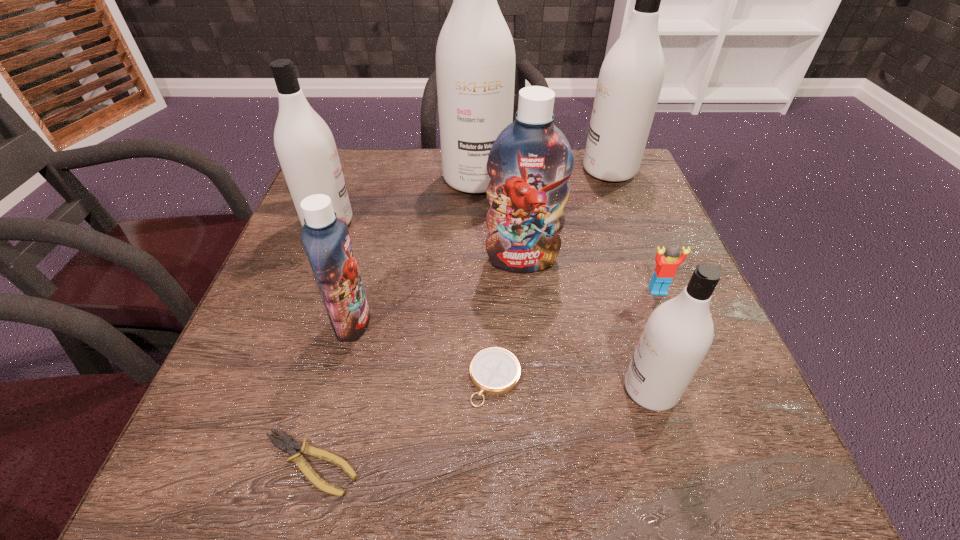
Identify the location of the tallest shampoo. The height and width of the screenshot is (540, 960). (475, 55).

In order to click on the tallest object in this screenshot , I will do `click(475, 55)`.

This screenshot has width=960, height=540. I want to click on the second tallest object, so click(x=630, y=79).

The image size is (960, 540). I want to click on the second tallest shampoo, so click(x=630, y=79).

The width and height of the screenshot is (960, 540). In order to click on the second smallest white shampoo in this screenshot , I will do `click(305, 146)`.

Locate an element on the screen. This screenshot has height=540, width=960. the fourth nearest shampoo is located at coordinates (305, 146).

At what (x,y) coordinates should I click in order to perform the action: click on the sixth nearest object. Please return your answer as a coordinate pair (x, y). The width and height of the screenshot is (960, 540). Looking at the image, I should click on (530, 162).

You are a GUI agent. You are given a task and a screenshot of the screen. Output one action in this format:
    pyautogui.click(x=<x>, y=<y>)
    Task: Click on the bigger blue shampoo
    
    Given the screenshot: What is the action you would take?
    530,162

The height and width of the screenshot is (540, 960). I want to click on the second shampoo from left to right, so click(x=326, y=240).

Identify the location of the left blue shampoo. (326, 240).